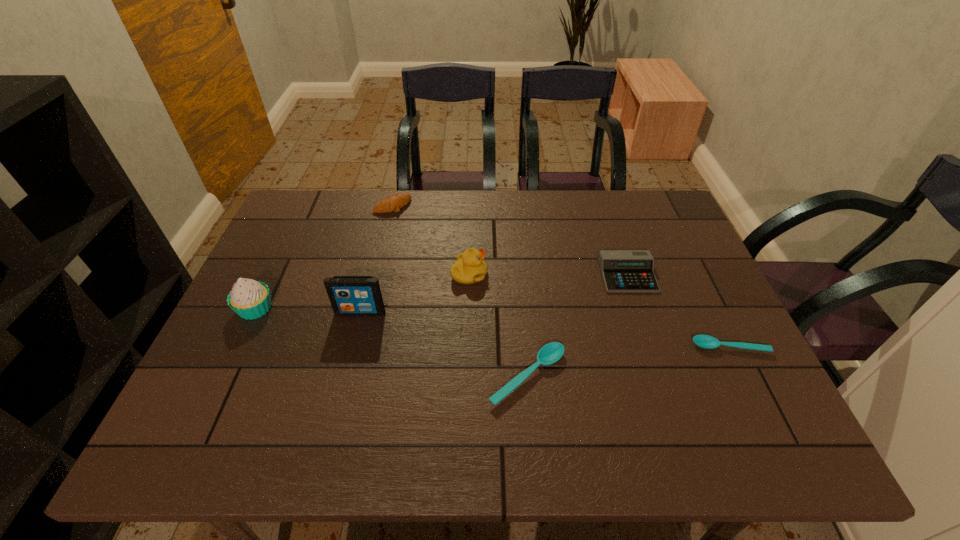
I want to click on calculator positioned at the right edge, so click(622, 270).

I want to click on free space at the far edge, so click(x=555, y=204).

The image size is (960, 540). I want to click on free space at the near edge, so click(x=454, y=393).

Find the location of a particular element. vacant space at the right edge is located at coordinates (683, 361).

Find the location of a particular element. This screenshot has height=540, width=960. free space at the far left corner of the desktop is located at coordinates (327, 193).

The image size is (960, 540). Identify the location of vacant space at the near left corner. (259, 383).

Where is `free space between the duckling and the farthest object`? free space between the duckling and the farthest object is located at coordinates coord(431,240).

Where is `free spot between the calculator and the taller spoon`? free spot between the calculator and the taller spoon is located at coordinates (577, 326).

What are the coordinates of `free spot between the right spoon and the cupcake` in the screenshot? It's located at (492, 328).

Image resolution: width=960 pixels, height=540 pixels. Find the location of `unoccupied area between the second object from right to left and the farthest object`. unoccupied area between the second object from right to left and the farthest object is located at coordinates (510, 240).